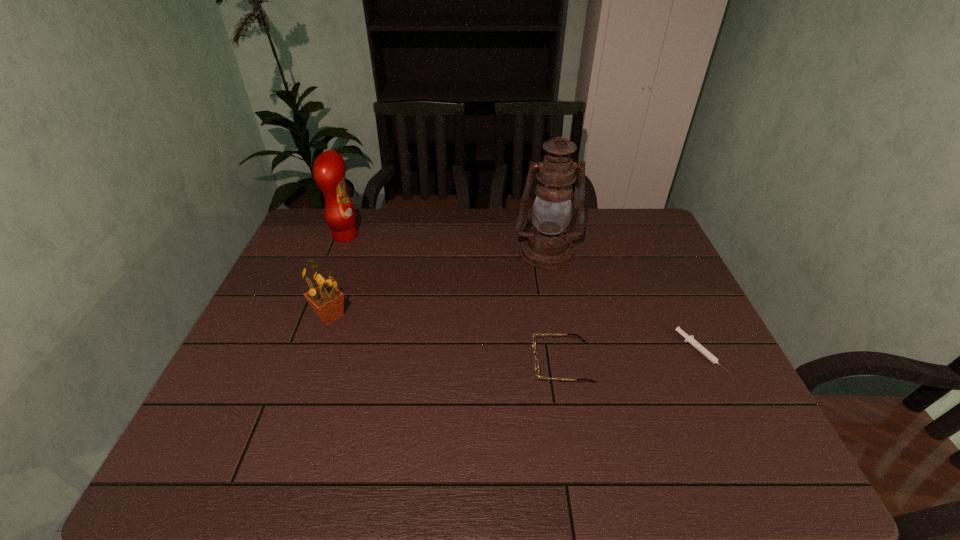
In order to click on vacant space at the far edge of the desktop in this screenshot , I will do `click(611, 241)`.

The width and height of the screenshot is (960, 540). In the image, there is a desktop. In order to click on free space at the near edge in this screenshot , I will do `click(324, 467)`.

Where is `vacant region at the left edge of the desktop`? vacant region at the left edge of the desktop is located at coordinates (290, 302).

Where is `vacant space at the right edge of the desktop`? vacant space at the right edge of the desktop is located at coordinates (689, 387).

Locate an element on the screen. Image resolution: width=960 pixels, height=540 pixels. vacant region between the condiment and the shortest object is located at coordinates (523, 294).

In order to click on free space that is in between the spectacles and the oil lamp in this screenshot , I will do `click(555, 307)`.

In order to click on unoccupied position between the oil lamp and the shortest object in this screenshot , I will do `click(624, 302)`.

The height and width of the screenshot is (540, 960). Identify the location of free space between the third shortest object and the fourth shortest object. (338, 275).

Identify the location of free spot between the oil lamp and the sunflower. (439, 284).

Identify the location of blank region between the condiment and the tallest object. (446, 244).